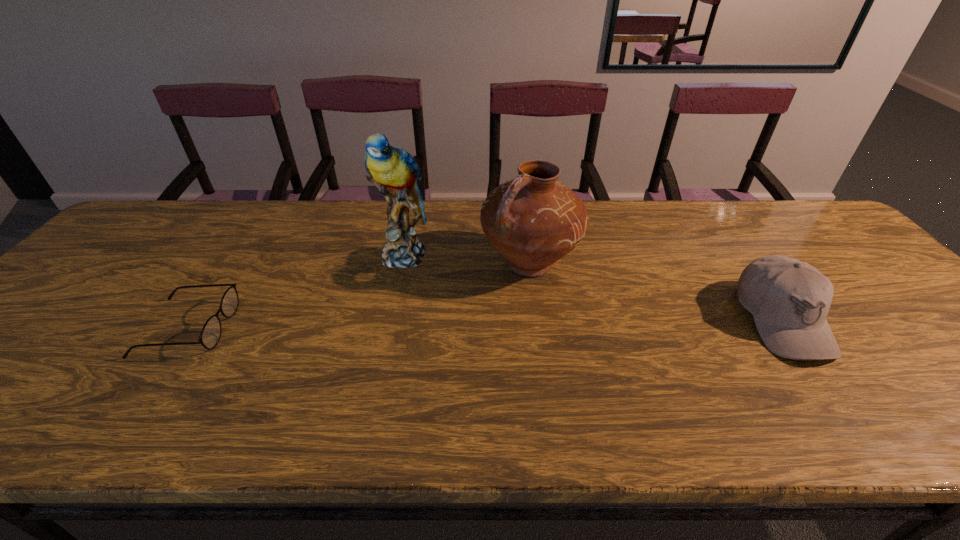
Find the location of `vacant point located between the tallest object and the shortest object`. vacant point located between the tallest object and the shortest object is located at coordinates (295, 291).

Find the location of a particular element. free space between the pottery and the second object from left to right is located at coordinates (466, 258).

Locate an element on the screen. Image resolution: width=960 pixels, height=540 pixels. object that is the third closest to the shortest object is located at coordinates (789, 299).

Find the location of `the third closest object to the shortest object`. the third closest object to the shortest object is located at coordinates (789, 299).